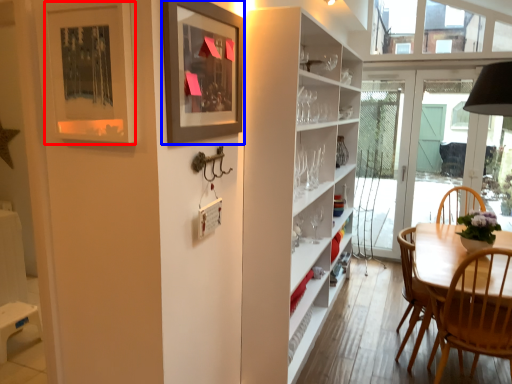
Question: Which object is further to the camera taking this photo, picture frame (highlighted by a red box) or picture frame (highlighted by a blue box)?

Choices:
 (A) picture frame
 (B) picture frame

Answer: (B)